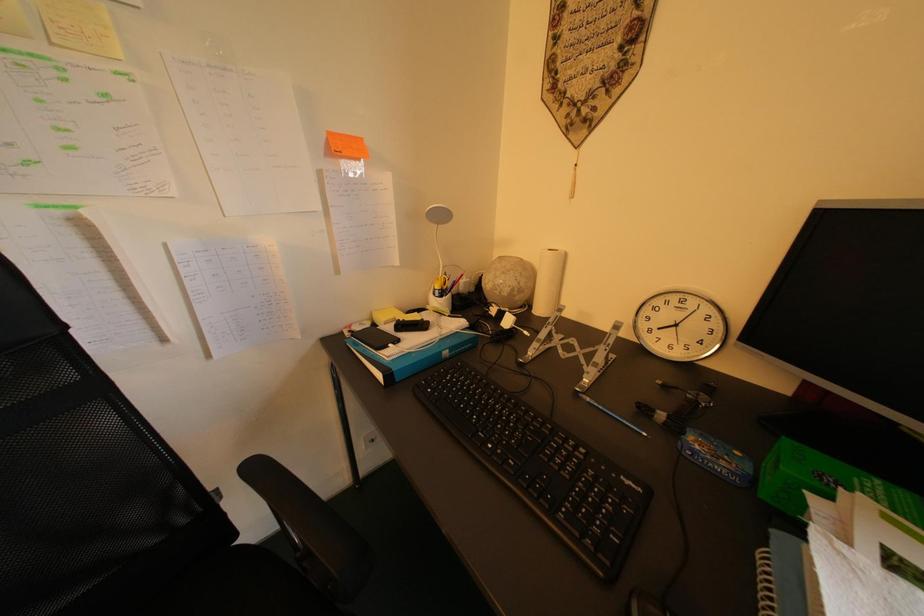
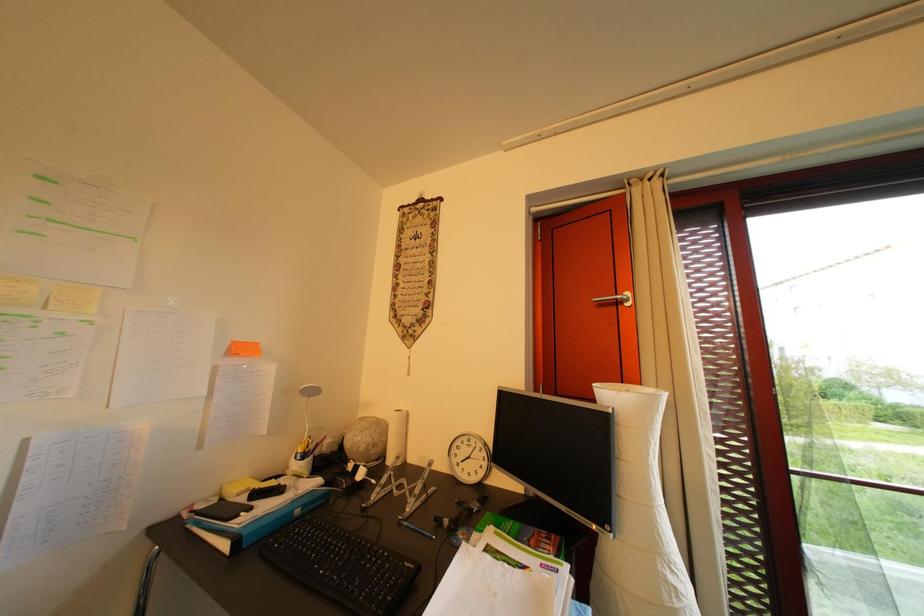
The first image is from the beginning of the video and the second image is from the end. How did the camera likely rotate when shooting the video?

The camera's rotation is toward right-up.